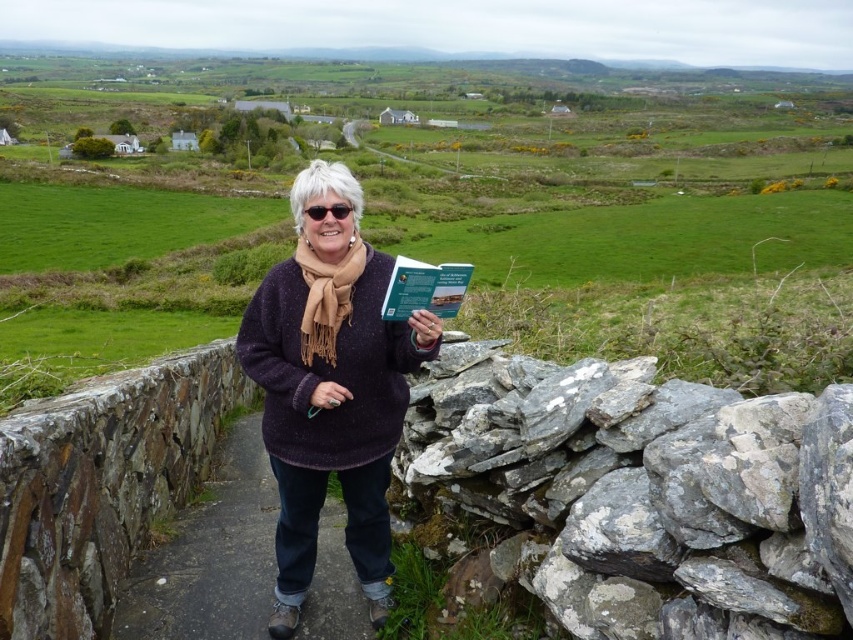
Between gray rough stone at right and tan soft scarf at center, which one is positioned lower?

gray rough stone at right is lower down.

Who is shorter, gray rough stone at right or tan soft scarf at center?

tan soft scarf at center

Where is `gray rough stone at right`? This screenshot has width=853, height=640. gray rough stone at right is located at coordinates (637, 493).

Which is in front, point (215, 564) or point (431, 307)?

Point (431, 307)

What do you see at coordinates (244, 557) in the screenshot? I see `dark stone path at center` at bounding box center [244, 557].

Between point (306, 472) and point (393, 317), which one is positioned behind?

Point (306, 472)

At what (x,y) coordinates should I click in order to perform the action: click on dark stone path at center. Please return your answer as a coordinate pair (x, y). Image resolution: width=853 pixels, height=640 pixels. Looking at the image, I should click on (244, 557).

Can you confirm if gray rough stone at right is thinner than green matte book at center?

In fact, gray rough stone at right might be wider than green matte book at center.

Between gray rough stone at right and green matte book at center, which one appears on the right side from the viewer's perspective?

Positioned to the right is gray rough stone at right.

Which is behind, point (462, 420) or point (459, 282)?

Point (462, 420)

The image size is (853, 640). What are the coordinates of `gray rough stone at right` in the screenshot? It's located at (637, 493).